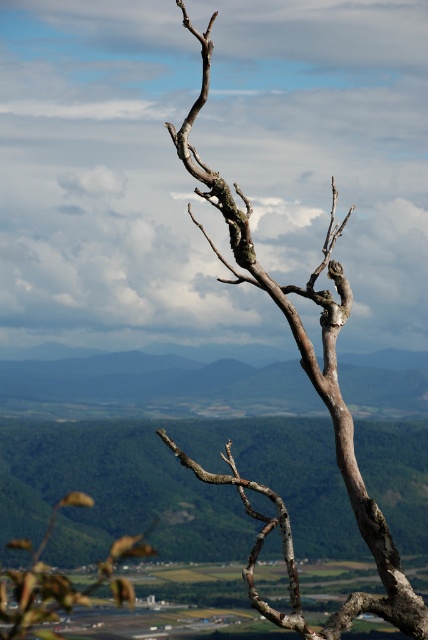
Who is shorter, green grassy plain at center or barky brown branch at upper right?

With less height is barky brown branch at upper right.

Find the location of a particular element. This screenshot has height=640, width=428. green grassy plain at center is located at coordinates (152, 387).

From the picture: Is green grassy plain at center above smooth brown branch at center?

Indeed, green grassy plain at center is positioned over smooth brown branch at center.

Is green grassy plain at center wider than smooth brown branch at center?

In fact, green grassy plain at center might be narrower than smooth brown branch at center.

What are the coordinates of `green grassy plain at center` in the screenshot? It's located at (152, 387).

The width and height of the screenshot is (428, 640). I want to click on green grassy plain at center, so click(x=152, y=387).

Does barky brown branch at upper right have a smaller size compared to smooth brown branch at center?

Correct, barky brown branch at upper right occupies less space than smooth brown branch at center.

Does barky brown branch at upper right have a greater width compared to smooth brown branch at center?

Incorrect, barky brown branch at upper right's width does not surpass smooth brown branch at center's.

Locate an element on the screen. barky brown branch at upper right is located at coordinates (318, 394).